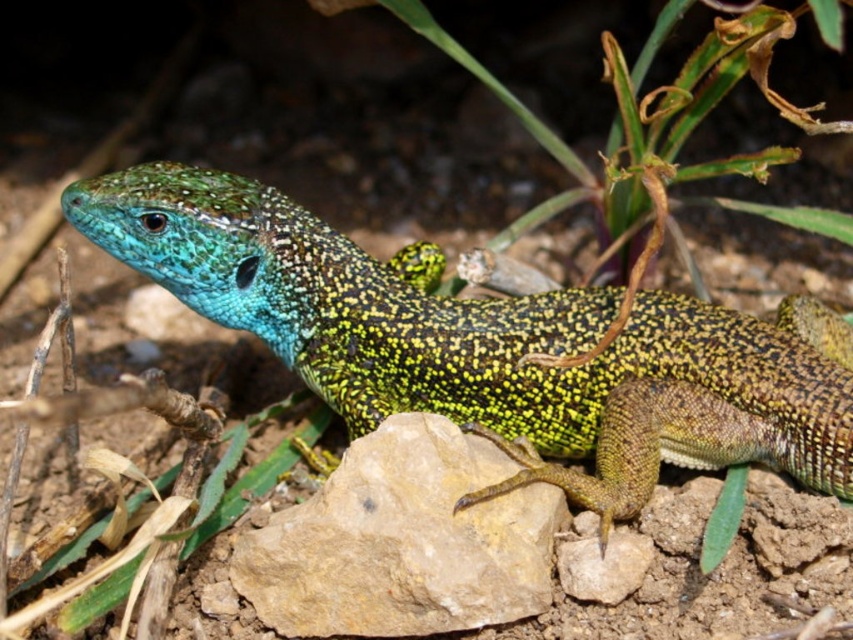
Is green speckled lizard at center wider than smooth beige rock at center?

Indeed, green speckled lizard at center has a greater width compared to smooth beige rock at center.

Is green speckled lizard at center to the left of smooth beige rock at center from the viewer's perspective?

Indeed, green speckled lizard at center is positioned on the left side of smooth beige rock at center.

You are a GUI agent. You are given a task and a screenshot of the screen. Output one action in this format:
    pyautogui.click(x=<x>, y=<y>)
    Task: Click on the green speckled lizard at center
    The width and height of the screenshot is (853, 640).
    Given the screenshot: What is the action you would take?
    (x=490, y=342)

You are a GUI agent. You are given a task and a screenshot of the screen. Output one action in this format:
    pyautogui.click(x=<x>, y=<y>)
    Task: Click on the green speckled lizard at center
    
    Given the screenshot: What is the action you would take?
    pyautogui.click(x=490, y=342)

Image resolution: width=853 pixels, height=640 pixels. What do you see at coordinates (403, 541) in the screenshot?
I see `brown rough rock at center` at bounding box center [403, 541].

Can you confirm if brown rough rock at center is taller than smooth beige rock at center?

Correct, brown rough rock at center is much taller as smooth beige rock at center.

Does point (425, 497) come closer to viewer compared to point (619, 556)?

Yes, point (425, 497) is closer to viewer.

Locate an element on the screen. The width and height of the screenshot is (853, 640). brown rough rock at center is located at coordinates (403, 541).

Who is shorter, green speckled lizard at center or brown rough rock at center?

brown rough rock at center is shorter.

Can you confirm if green speckled lizard at center is smaller than brown rough rock at center?

Actually, green speckled lizard at center might be larger than brown rough rock at center.

Where is `green speckled lizard at center`? The width and height of the screenshot is (853, 640). green speckled lizard at center is located at coordinates (490, 342).